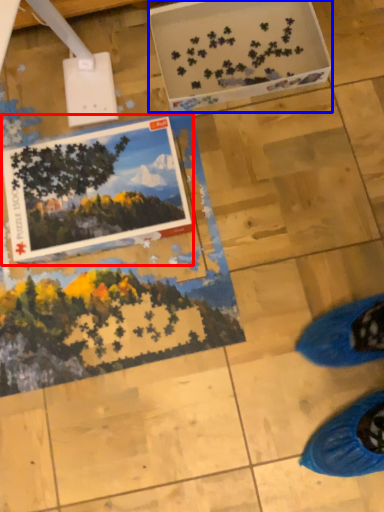
Question: Among these objects, which one is nearest to the camera, postcard (highlighted by a red box) or cardboard box (highlighted by a blue box)?

Choices:
 (A) postcard
 (B) cardboard box

Answer: (A)